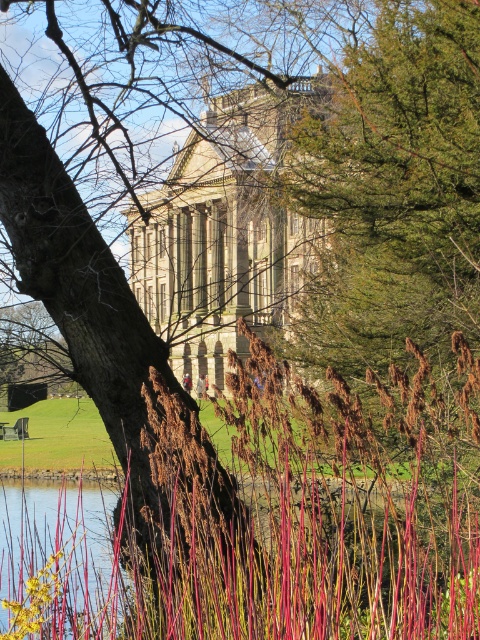
This screenshot has height=640, width=480. Identify the location of reddish-brown grass at center. (275, 524).

Who is lower down, reddish-brown grass at center or clear water at lower left?

clear water at lower left is lower down.

The height and width of the screenshot is (640, 480). What do you see at coordinates (275, 524) in the screenshot?
I see `reddish-brown grass at center` at bounding box center [275, 524].

You are a GUI agent. You are given a task and a screenshot of the screen. Output one action in this format:
    pyautogui.click(x=<x>, y=<y>)
    Task: Click on the reddish-brown grass at center
    
    Given the screenshot: What is the action you would take?
    pyautogui.click(x=275, y=524)